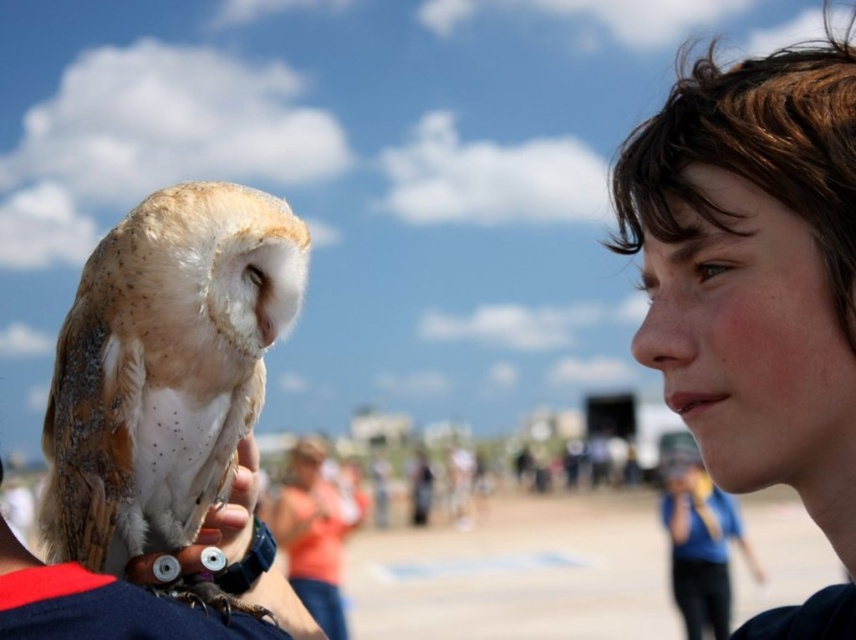
You are a photographer trying to capture the owl in the image. The owl is perched on a person wearing a wristwatch and bracelet. The photographer wants to ensure the owl is centered in the frame. Given that the point marking the owl is at coordinates [164,368], is the owl currently centered horizontally and vertically in the image?

The point marking the speckled feathered owl at left is at coordinates [164,368]. Since the x coordinate is 0.575, which is slightly to the right of center, and the y coordinate is 0.193, which is near the top of the image, the owl is not centered both horizontally and vertically.

You are a photographer trying to capture a clear shot of the speckled feathered owl at left and the blurred orange shirt at center. Which object should you focus on to ensure it appears sharp in the photo?

You should focus on the speckled feathered owl at left because it is closer to the camera than the blurred orange shirt at center, which is farther away and more likely to be out of focus.